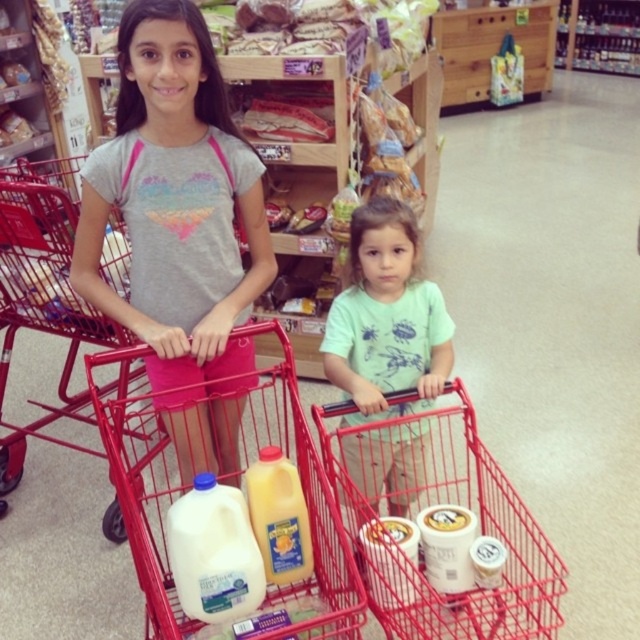
Can you confirm if matte gray t-shirt at center is positioned below metallic red shopping cart at center?

No, matte gray t-shirt at center is not below metallic red shopping cart at center.

Can you confirm if matte gray t-shirt at center is bigger than metallic red shopping cart at center?

Incorrect, matte gray t-shirt at center is not larger than metallic red shopping cart at center.

Describe the element at coordinates (176, 200) in the screenshot. I see `matte gray t-shirt at center` at that location.

The image size is (640, 640). I want to click on matte gray t-shirt at center, so click(x=176, y=200).

Between green matte shirt at center and white matte yogurt at lower center, which one has less height?

white matte yogurt at lower center is shorter.

Is point (378, 349) positioned after point (440, 577)?

Yes, point (378, 349) is behind point (440, 577).

The width and height of the screenshot is (640, 640). Find the location of `green matte shirt at center`. green matte shirt at center is located at coordinates (387, 317).

Does metallic red shopping cart at center have a larger size compared to white matte yogurt at lower center?

Indeed, metallic red shopping cart at center has a larger size compared to white matte yogurt at lower center.

Who is positioned more to the left, metallic red shopping cart at center or white matte yogurt at lower center?

white matte yogurt at lower center is more to the left.

What do you see at coordinates (477, 529) in the screenshot? The width and height of the screenshot is (640, 640). I see `metallic red shopping cart at center` at bounding box center [477, 529].

Locate an element on the screen. metallic red shopping cart at center is located at coordinates coord(477,529).